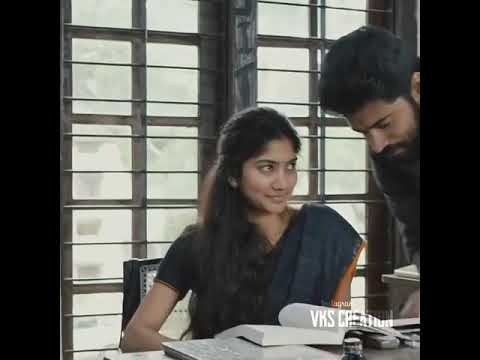
Locate an element on the screen. The height and width of the screenshot is (360, 480). book is located at coordinates (288, 331).